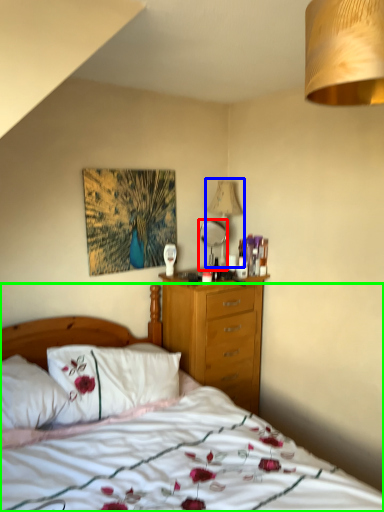
Question: Which is farther away from mirror (highlighted by a red box)? lamp (highlighted by a blue box) or bed (highlighted by a green box)?

Choices:
 (A) lamp
 (B) bed

Answer: (B)